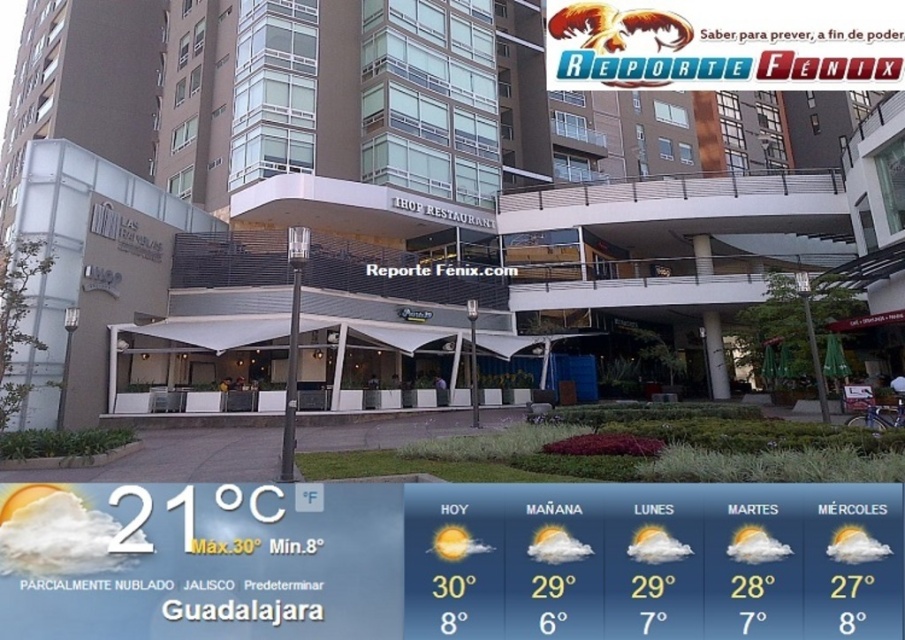
You are a visitor approaching the IHOP RESTAURANT entrance and notice the white awning at center and the white cloud weather forecast at lower left. From your perspective, which object is located to the right of the other?

The white awning at center is positioned on the right side of white cloud weather forecast at lower left, so from your perspective, the white awning at center is to the right of the white cloud weather forecast at lower left.

You are a delivery person approaching the IHOP RESTAURANT entrance. You notice the white awning at center and the white cloud weather forecast at lower left. Which object appears bigger in the image?

The white awning at center appears larger in size than the white cloud weather forecast at lower left.